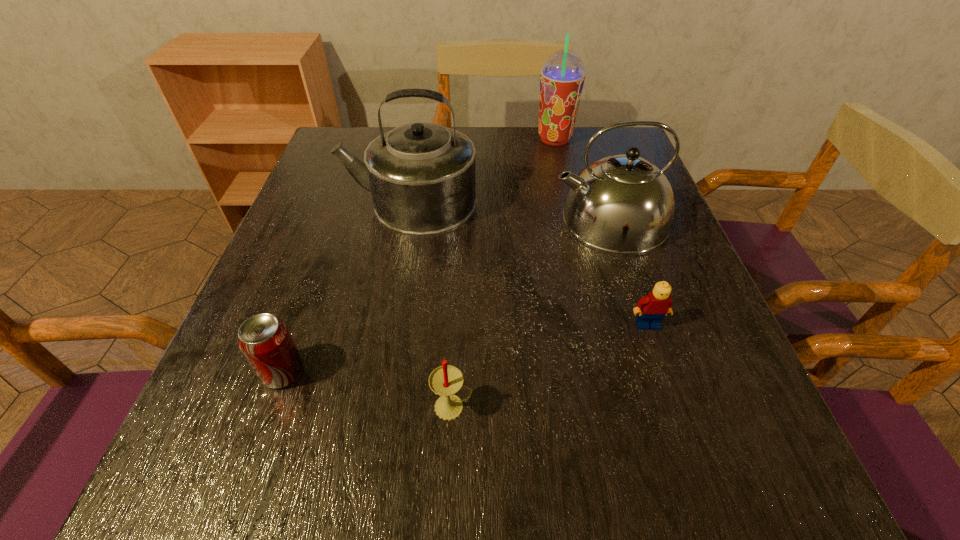
Locate an element on the screen. free space located from the spout of the right kettle is located at coordinates (470, 219).

Identify the location of vacant space located 0.350m from the spout of the right kettle. The image size is (960, 540). (394, 219).

Locate an element on the screen. The width and height of the screenshot is (960, 540). vacant space located 0.110m on the right of the candle is located at coordinates (546, 407).

Identify the location of vacant space situated 0.080m on the right of the fifth farthest object. (355, 372).

This screenshot has height=540, width=960. What are the coordinates of `vacant space located on the front-facing side of the Lego` in the screenshot? It's located at (687, 444).

In order to click on smoothie located at the far edge in this screenshot , I will do `click(562, 77)`.

The width and height of the screenshot is (960, 540). I want to click on kettle present at the far edge, so click(x=421, y=175).

Where is `kettle at the left edge`? Image resolution: width=960 pixels, height=540 pixels. kettle at the left edge is located at coordinates click(x=421, y=175).

Find the location of a particular element. soda can located at the left edge is located at coordinates (265, 341).

The width and height of the screenshot is (960, 540). I want to click on smoothie that is at the right edge, so click(562, 77).